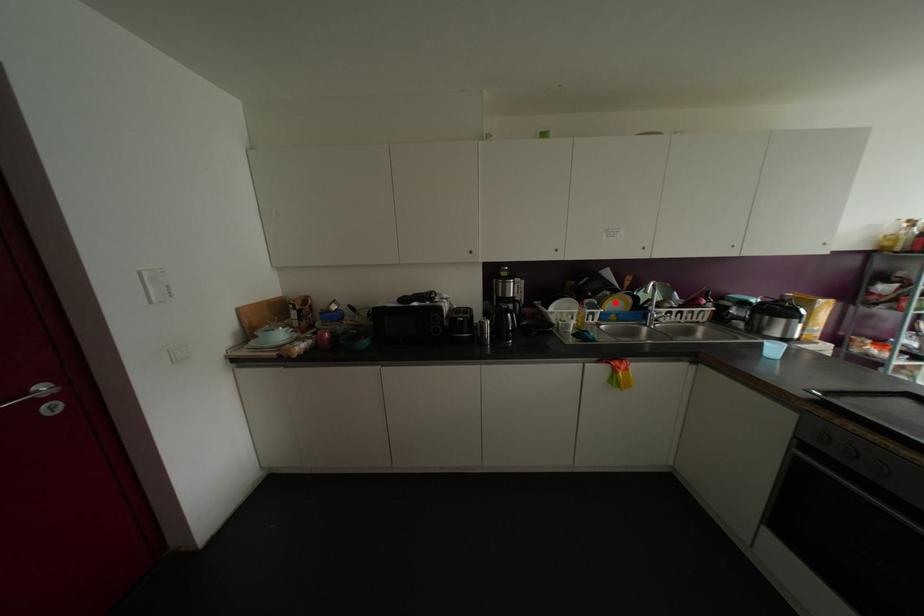
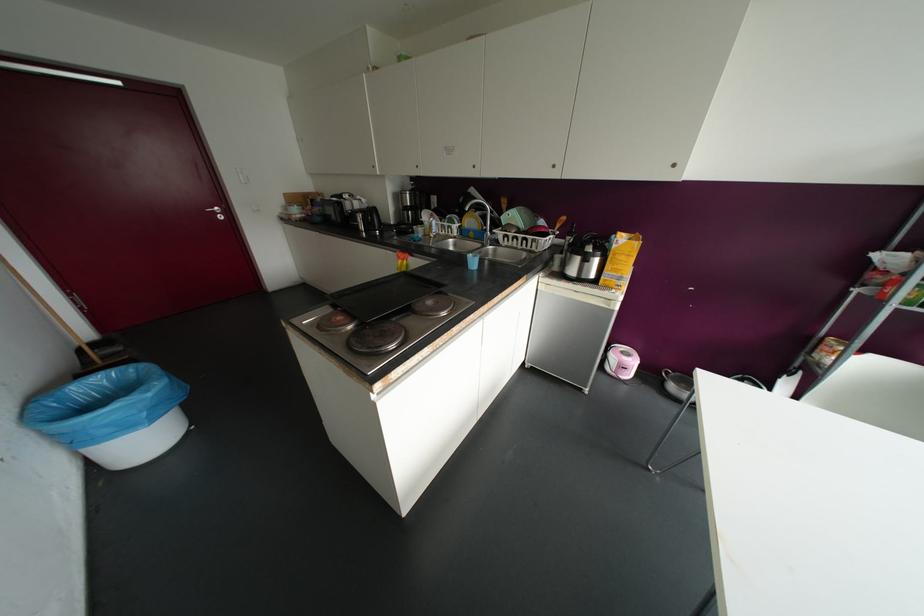
Find the pixel in the second image that matches the highlighted location in the first image.

(469, 221)